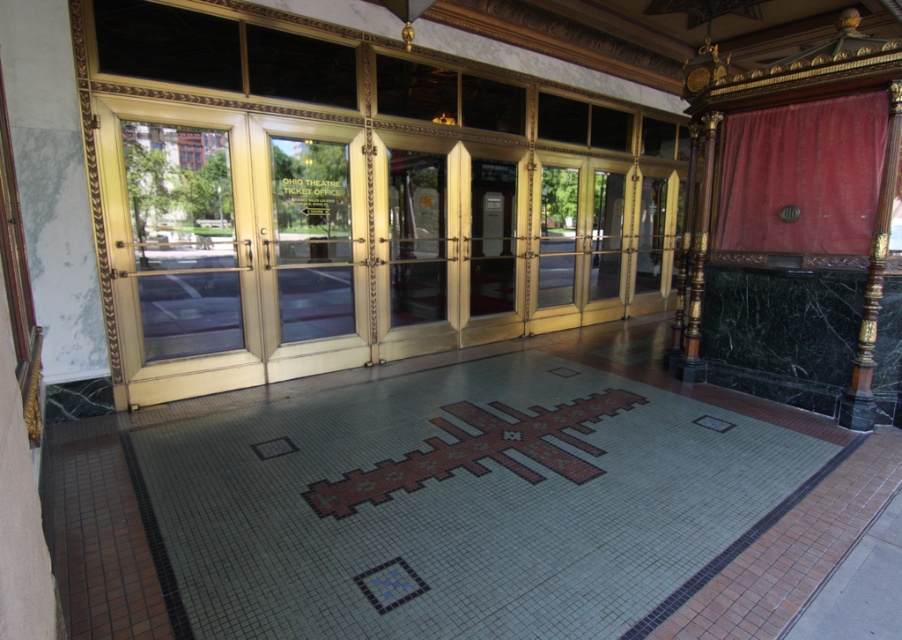
Question: Is gold/gilded doors at center bigger than velvet red curtain at upper right?

Choices:
 (A) no
 (B) yes

Answer: (A)

Question: Which object is farther from the camera taking this photo?

Choices:
 (A) velvet red curtain at upper right
 (B) gold/gilded doors at center

Answer: (B)

Question: Can you confirm if gold/gilded doors at center is wider than velvet red curtain at upper right?

Choices:
 (A) no
 (B) yes

Answer: (A)

Question: Which point is farther from the camera taking this photo?

Choices:
 (A) (821, 212)
 (B) (183, 227)

Answer: (A)

Question: Does gold/gilded doors at center appear under velvet red curtain at upper right?

Choices:
 (A) yes
 (B) no

Answer: (B)